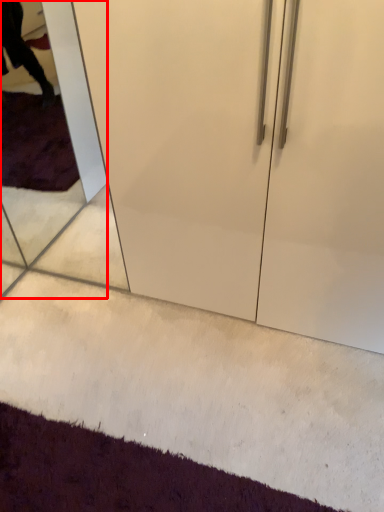
Question: From the image's perspective, considering the relative positions of glass door (annotated by the red box) and doormat in the image provided, where is glass door (annotated by the red box) located with respect to the staircase?

Choices:
 (A) above
 (B) below

Answer: (A)